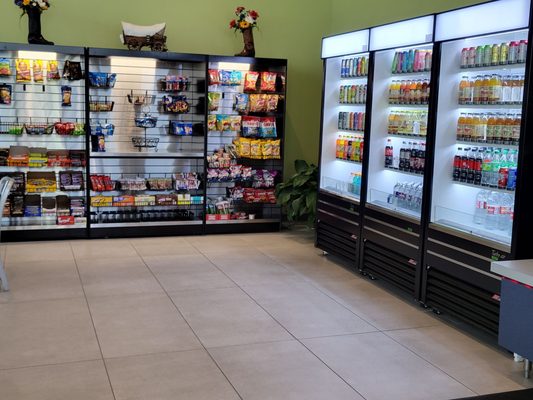
Where is `table`? The width and height of the screenshot is (533, 400). table is located at coordinates (520, 271).